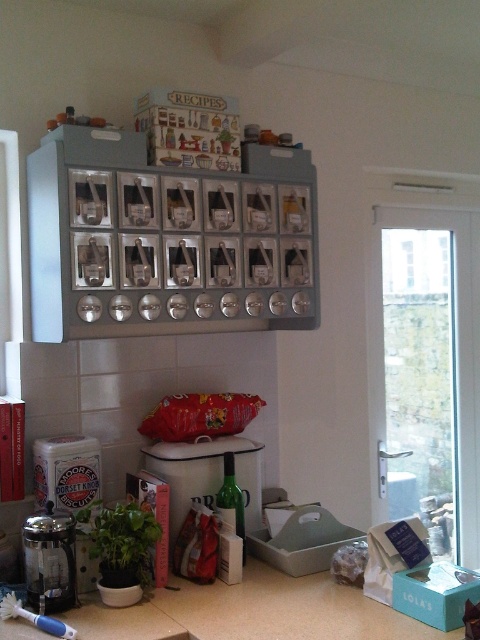
From the picture: Does beige laminate countertop at lower center come behind matte white canister at center?

That is False.

Who is more forward, [387,636] or [178,490]?

Point [387,636] is in front.

Find the location of a particular element. This screenshot has width=480, height=640. beige laminate countertop at lower center is located at coordinates (252, 612).

This screenshot has height=640, width=480. I want to click on beige laminate countertop at lower center, so click(252, 612).

The width and height of the screenshot is (480, 640). What do you see at coordinates (206, 476) in the screenshot?
I see `matte white canister at center` at bounding box center [206, 476].

Between matte white canister at center and metallic glass coffee maker at lower left, which one has less height?

metallic glass coffee maker at lower left

Image resolution: width=480 pixels, height=640 pixels. I want to click on matte white canister at center, so tap(206, 476).

Which is in front, point (257, 596) or point (51, 605)?

Point (51, 605) is in front.

Describe the element at coordinates (252, 612) in the screenshot. I see `beige laminate countertop at lower center` at that location.

Is point (192, 595) in front of point (49, 554)?

No, it is not.

Find the location of `beige laminate countertop at lower center`. beige laminate countertop at lower center is located at coordinates (252, 612).